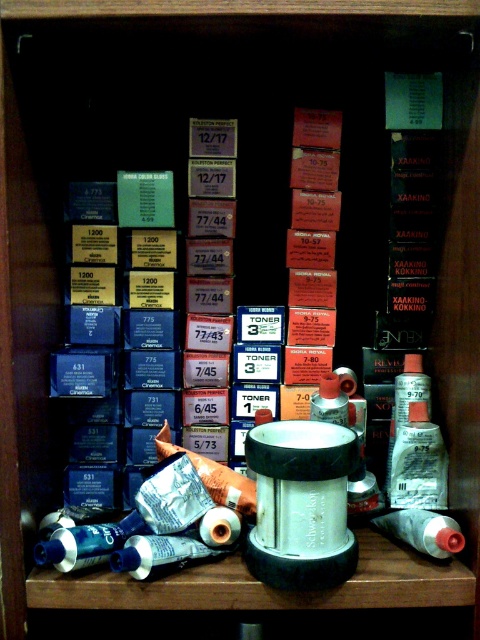
You are standing in front of the wooden shelf and want to reach two points on the shelf. The first point is at coordinates point (408, 442) and the second is at point (317, 397). Which point is easier to reach without moving your hand?

Point (408, 442) is closer to the viewer than point (317, 397), so it is easier to reach without moving your hand.